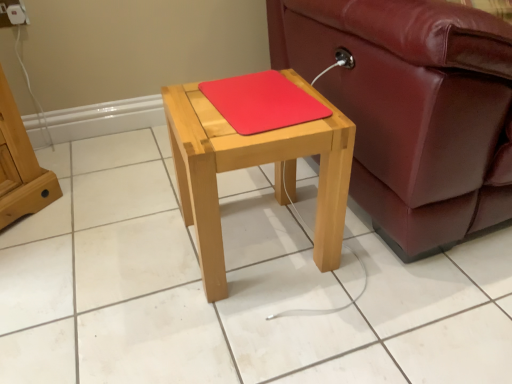
This screenshot has height=384, width=512. Identify the location of free space that is to the left of natural wood table at center. (135, 253).